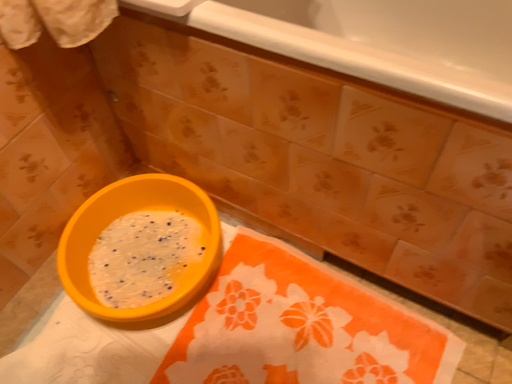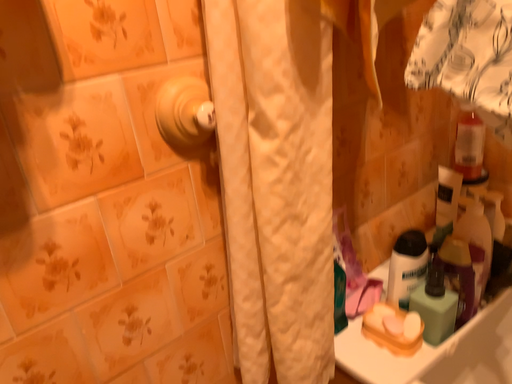
Question: How did the camera likely rotate when shooting the video?

Choices:
 (A) rotated left
 (B) rotated right

Answer: (A)